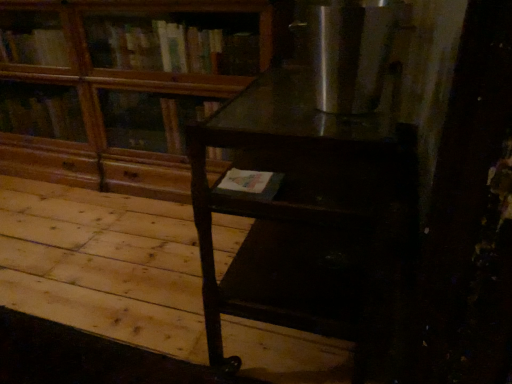
Question: Is wooden at upper left inside dark wood table at center?

Choices:
 (A) yes
 (B) no

Answer: (B)

Question: Does dark wood table at center have a larger size compared to wooden at upper left?

Choices:
 (A) no
 (B) yes

Answer: (A)

Question: Is dark wood table at center placed right next to wooden at upper left?

Choices:
 (A) no
 (B) yes

Answer: (A)

Question: Considering the relative sizes of dark wood table at center and wooden at upper left in the image provided, is dark wood table at center wider than wooden at upper left?

Choices:
 (A) no
 (B) yes

Answer: (B)

Question: From the image's perspective, is dark wood table at center located above wooden at upper left?

Choices:
 (A) yes
 (B) no

Answer: (B)

Question: Considering the positions of dark wood table at center and stainless steel refrigerator at upper right in the image, is dark wood table at center wider or thinner than stainless steel refrigerator at upper right?

Choices:
 (A) wide
 (B) thin

Answer: (A)

Question: Choose the correct answer: Is dark wood table at center inside stainless steel refrigerator at upper right or outside it?

Choices:
 (A) inside
 (B) outside

Answer: (B)

Question: In the image, is dark wood table at center positioned in front of or behind stainless steel refrigerator at upper right?

Choices:
 (A) front
 (B) behind

Answer: (A)

Question: Visually, is dark wood table at center positioned to the left or to the right of stainless steel refrigerator at upper right?

Choices:
 (A) left
 (B) right

Answer: (A)

Question: From the image's perspective, is wooden at upper left positioned above or below dark wood table at center?

Choices:
 (A) below
 (B) above

Answer: (B)

Question: Which is correct: wooden at upper left is inside dark wood table at center, or outside of it?

Choices:
 (A) inside
 (B) outside

Answer: (B)

Question: Considering the positions of wooden at upper left and dark wood table at center in the image, is wooden at upper left taller or shorter than dark wood table at center?

Choices:
 (A) short
 (B) tall

Answer: (B)

Question: Considering their positions, is wooden at upper left located in front of or behind dark wood table at center?

Choices:
 (A) front
 (B) behind

Answer: (B)

Question: Considering the positions of dark wood table at center and wooden at upper left in the image, is dark wood table at center bigger or smaller than wooden at upper left?

Choices:
 (A) small
 (B) big

Answer: (A)

Question: From a real-world perspective, relative to wooden at upper left, is dark wood table at center vertically above or below?

Choices:
 (A) below
 (B) above

Answer: (A)